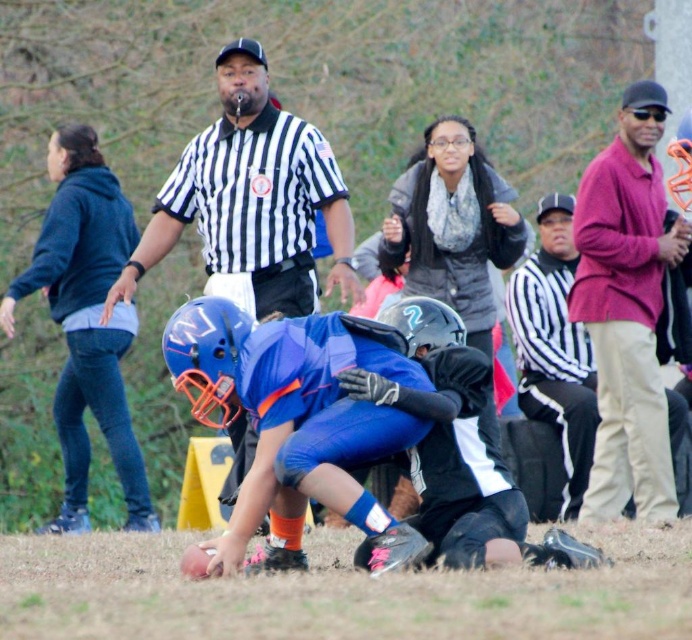
You are a spectator at the youth football game. You notice the black striped shirt at center and the matte pink shirt at right. Which one is closer to the referee who is signaling nearby?

The black striped shirt at center is closer to the referee because it is in front of the matte pink shirt at right.

You are a photographer at the youth football game. You want to take a photo of the black striped shirt at center and the matte pink shirt at right. Which one should you zoom in on first to ensure they both fit in the frame?

The black striped shirt at center is bigger than the matte pink shirt at right, so you should zoom in on the matte pink shirt at right first to accommodate the larger black striped shirt at center in the frame.